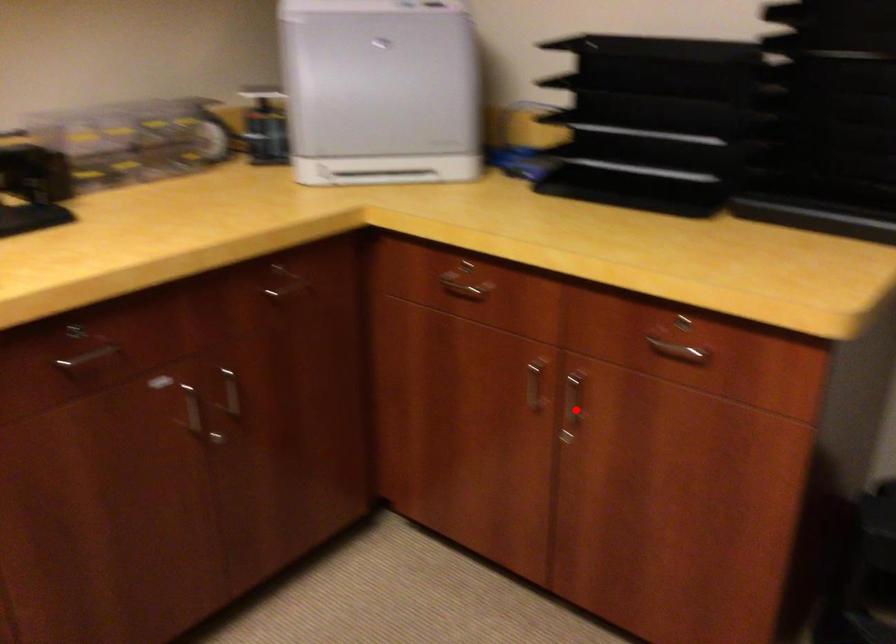
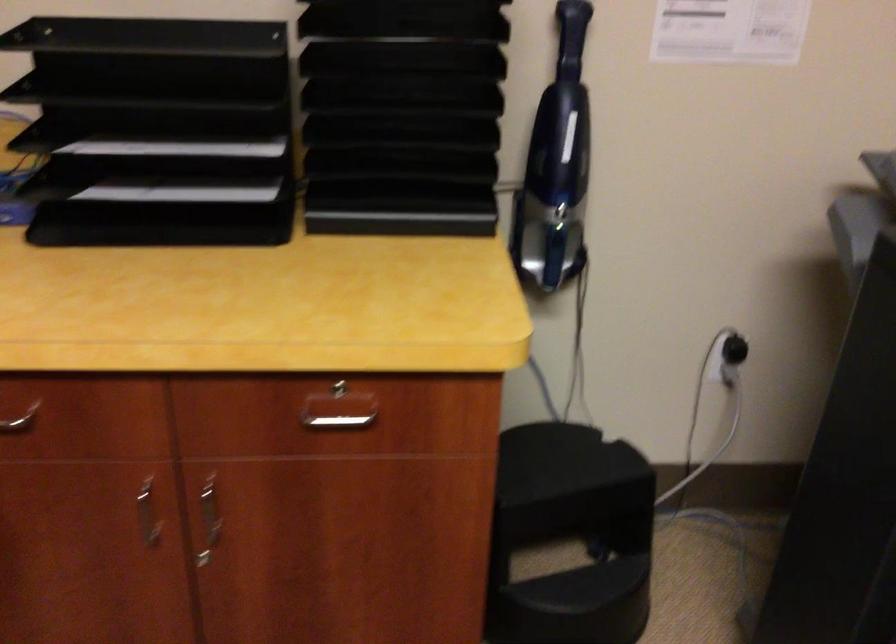
Find the pixel in the second image that matches the highlighted location in the first image.

(209, 520)